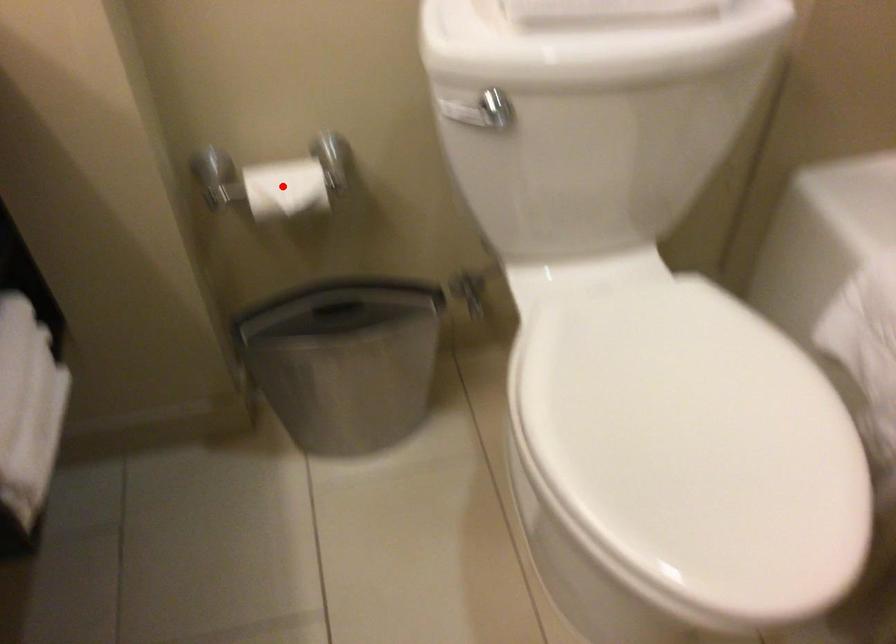
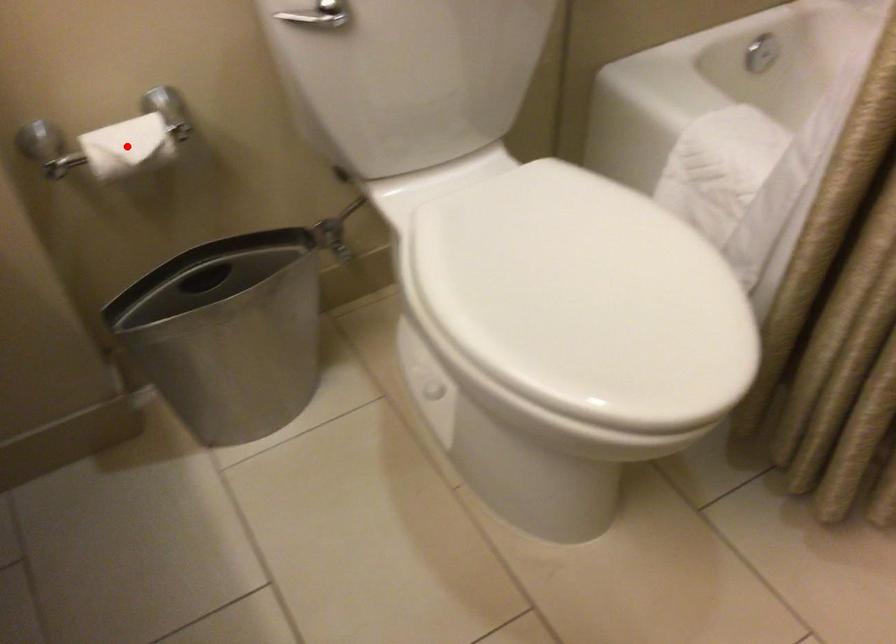
I am providing you with two images of the same scene from different viewpoints. A red point is marked on the first image and another point is marked on the second image. Do the highlighted points in image1 and image2 indicate the same real-world spot?

Yes